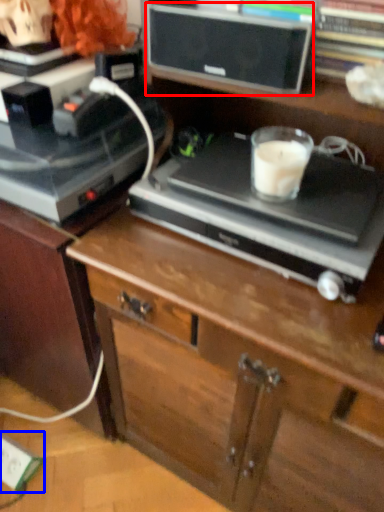
Question: Which of the following is the closest to the observer, speaker (highlighted by a red box) or electric outlet (highlighted by a blue box)?

Choices:
 (A) speaker
 (B) electric outlet

Answer: (A)